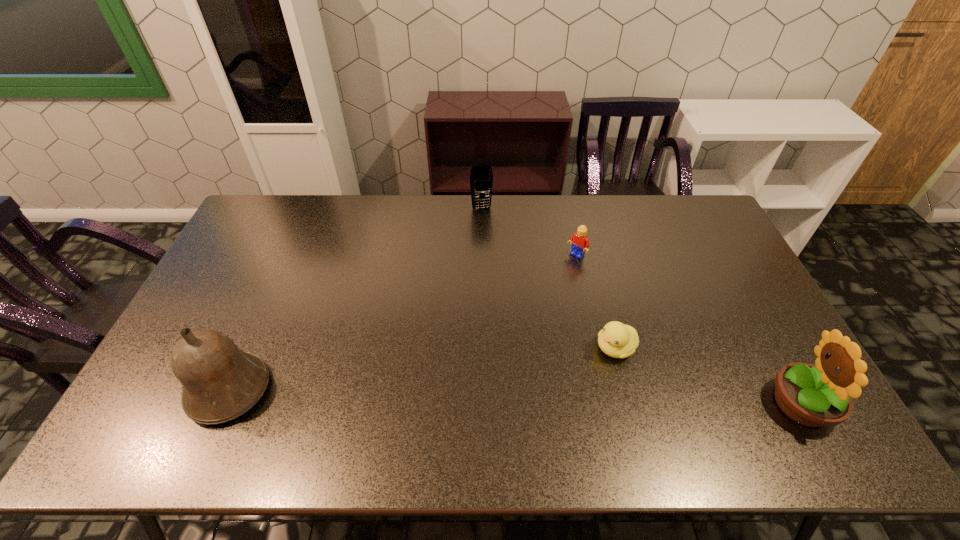
Where is `vacant region located 0.360m on the screen of the farthest object`? The height and width of the screenshot is (540, 960). vacant region located 0.360m on the screen of the farthest object is located at coordinates (499, 282).

Where is `free spot located on the screen of the farthest object`? This screenshot has height=540, width=960. free spot located on the screen of the farthest object is located at coordinates (496, 271).

Identify the location of vacant space located 0.350m on the screen of the farthest object. (498, 280).

The width and height of the screenshot is (960, 540). I want to click on vacant space situated at the beak of the shortest object, so click(582, 368).

Where is `vacant area situated 0.080m at the beak of the shortest object`? vacant area situated 0.080m at the beak of the shortest object is located at coordinates (579, 370).

Where is `vacant space located at the beak of the shortest object`? This screenshot has height=540, width=960. vacant space located at the beak of the shortest object is located at coordinates pyautogui.click(x=552, y=386).

You are a GUI agent. You are given a task and a screenshot of the screen. Output one action in this format:
    pyautogui.click(x=<x>, y=<y>)
    Task: Click on the free space located on the front-facing side of the Lego
    Image resolution: width=960 pixels, height=540 pixels.
    Given the screenshot: What is the action you would take?
    pyautogui.click(x=516, y=314)

In order to click on free space located 0.220m on the front-facing side of the Lego in this screenshot , I will do `click(532, 298)`.

At what (x,y) coordinates should I click in order to perform the action: click on free space located 0.260m on the front-facing side of the Lego. Please return your answer as a coordinate pair (x, y). The image size is (960, 540). Looking at the image, I should click on (524, 306).

Identify the location of object present at the far edge. (481, 177).